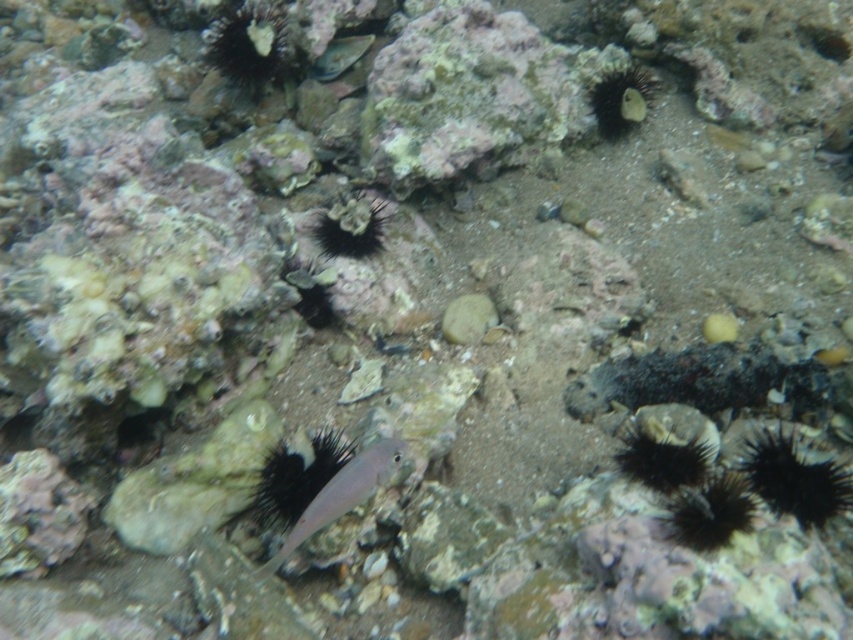
Is smooth white coral at upper center above smooth black sea urchin at upper right?

Indeed, smooth white coral at upper center is positioned over smooth black sea urchin at upper right.

Can you confirm if smooth white coral at upper center is bigger than smooth black sea urchin at upper right?

Yes, smooth white coral at upper center is bigger than smooth black sea urchin at upper right.

Looking at this image, who is more forward, (265,80) or (611,88)?

Point (611,88) is in front.

Locate an element on the screen. The width and height of the screenshot is (853, 640). smooth white coral at upper center is located at coordinates (250, 44).

Based on the photo, is pink translucent fish at center bigger than black spiny coral at center?

Indeed, pink translucent fish at center has a larger size compared to black spiny coral at center.

Is pink translucent fish at center below black spiny coral at center?

Indeed, pink translucent fish at center is positioned under black spiny coral at center.

Is point (302, 540) farther from camera compared to point (331, 211)?

No, it is not.

You are a GUI agent. You are given a task and a screenshot of the screen. Output one action in this format:
    pyautogui.click(x=<x>, y=<y>)
    Task: Click on the pink translucent fish at center
    This screenshot has width=853, height=640.
    Given the screenshot: What is the action you would take?
    pyautogui.click(x=340, y=496)

Can you confirm if pink translucent fish at center is bigger than shiny silver fish at upper center?

Correct, pink translucent fish at center is larger in size than shiny silver fish at upper center.

Describe the element at coordinates (340, 496) in the screenshot. I see `pink translucent fish at center` at that location.

I want to click on pink translucent fish at center, so click(340, 496).